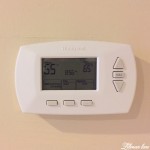
Identify the location of screen. This screenshot has height=150, width=150. (64, 69).